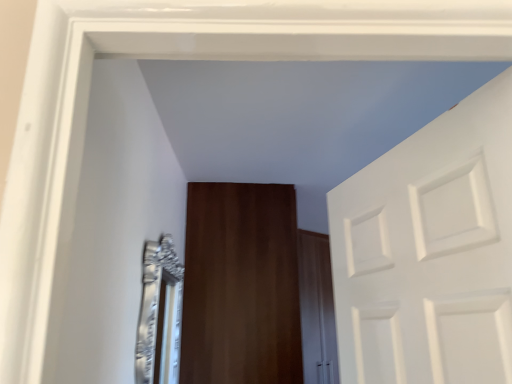
Question: Considering the positions of point (233, 291) and point (180, 309), is point (233, 291) closer or farther from the camera than point (180, 309)?

Choices:
 (A) closer
 (B) farther

Answer: (B)

Question: In terms of width, does wooden door at center look wider or thinner when compared to silver metallic mirror at left?

Choices:
 (A) wide
 (B) thin

Answer: (A)

Question: From a real-world perspective, is wooden door at center physically located above or below silver metallic mirror at left?

Choices:
 (A) above
 (B) below

Answer: (A)

Question: Is silver metallic mirror at left situated inside wooden door at center or outside?

Choices:
 (A) outside
 (B) inside

Answer: (A)

Question: From the image's perspective, is silver metallic mirror at left located above or below wooden door at center?

Choices:
 (A) above
 (B) below

Answer: (A)

Question: From a real-world perspective, relative to wooden door at center, is silver metallic mirror at left vertically above or below?

Choices:
 (A) below
 (B) above

Answer: (A)

Question: Considering the positions of silver metallic mirror at left and wooden door at center in the image, is silver metallic mirror at left taller or shorter than wooden door at center?

Choices:
 (A) tall
 (B) short

Answer: (B)